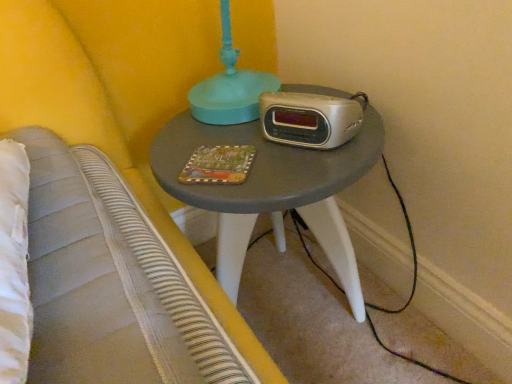
Find the location of `vacant space behind matte painted wood book at center`. vacant space behind matte painted wood book at center is located at coordinates (210, 127).